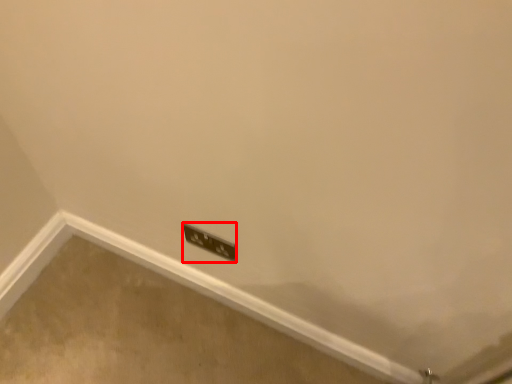
Question: From the image's perspective, where is power plugs and sockets (annotated by the red box) located relative to concrete?

Choices:
 (A) below
 (B) above

Answer: (B)